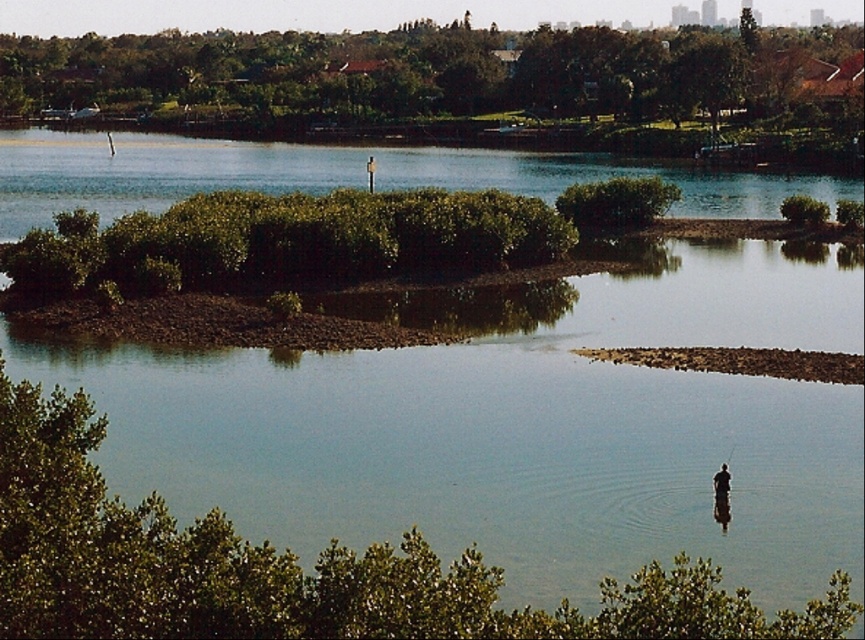
You are standing at the riverside and see the green leafy tree at lower center and the green leafy tree at upper center. Which tree is closer to you?

The green leafy tree at lower center is closer to you because it is located below the green leafy tree at upper center in the image.

You are standing at the point marked as point [290,566] in the image. What can you see directly in front of you?

You can see the green leafy tree at lower center directly in front of you because the point [290,566] is located on it.

You are a kayaker planning to navigate through the river between the green leafy tree at lower center and the dark brown wooden pole at center. Which direction should you paddle to avoid hitting the tree?

You should paddle to the right side of the dark brown wooden pole at center because the green leafy tree at lower center is positioned on the left side of it, so moving right would keep you away from the tree.